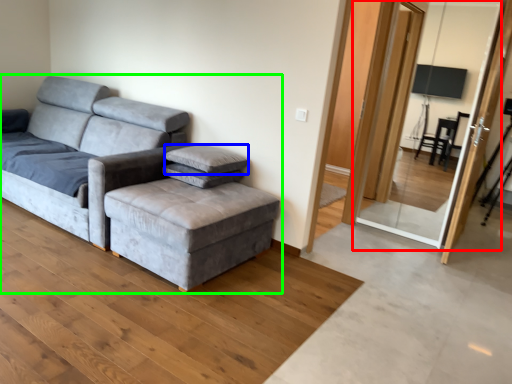
Question: Considering the real-world distances, which object is closest to screen door (highlighted by a red box)? pillow (highlighted by a blue box) or studio couch (highlighted by a green box).

Choices:
 (A) pillow
 (B) studio couch

Answer: (A)